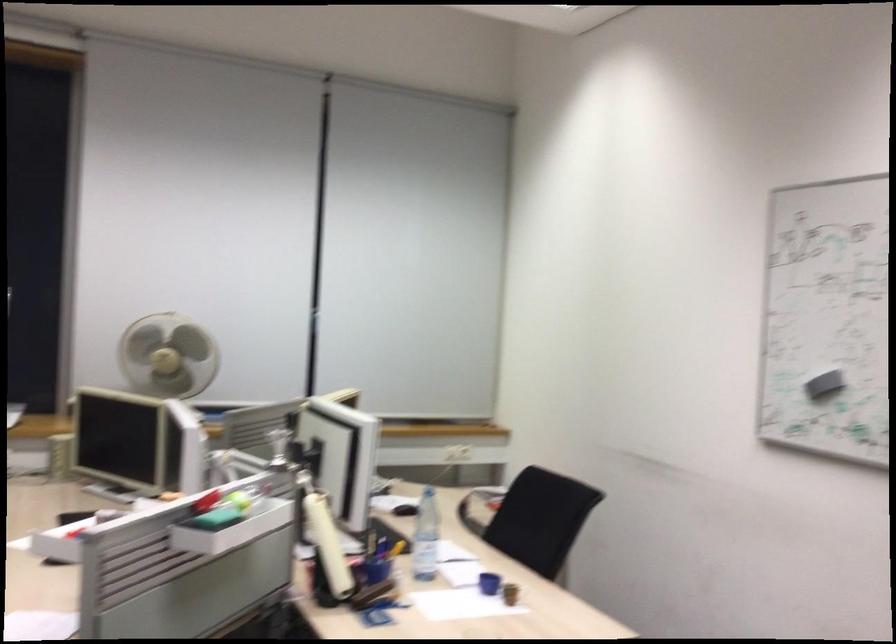
Describe the element at coordinates (377, 563) in the screenshot. This screenshot has height=644, width=896. I see `the blue pen holder` at that location.